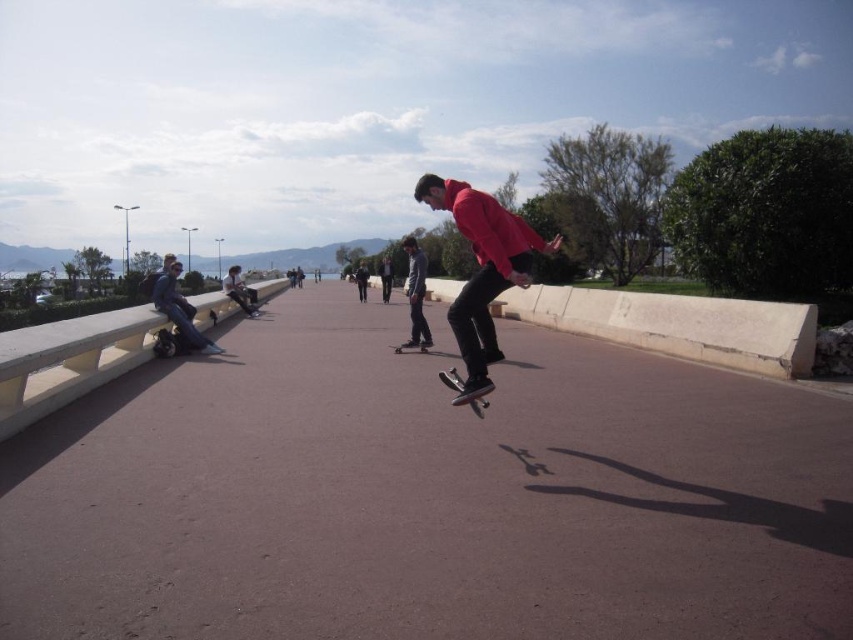
You are a photographer trying to capture a photo of the matte red hoodie at center and the black smooth skateboard at center. You want to ensure both are visible in the frame. Based on their positions, which object should you focus on first to include both in the shot?

The matte red hoodie at center is positioned on the right side of the black smooth skateboard at center. To include both in the shot, focus on the black smooth skateboard at center first as it is on the left, allowing the matte red hoodie at center to naturally fall into the frame on the right side.